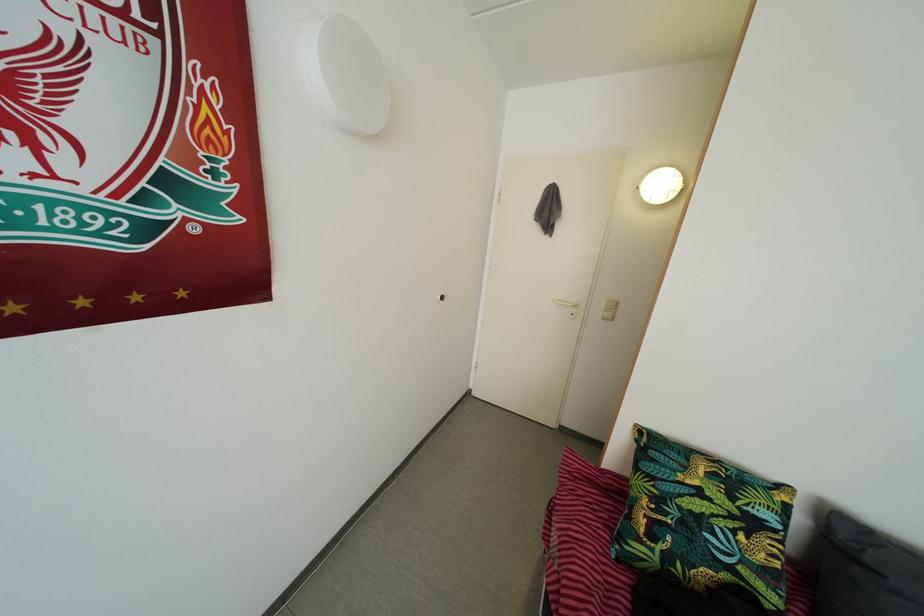
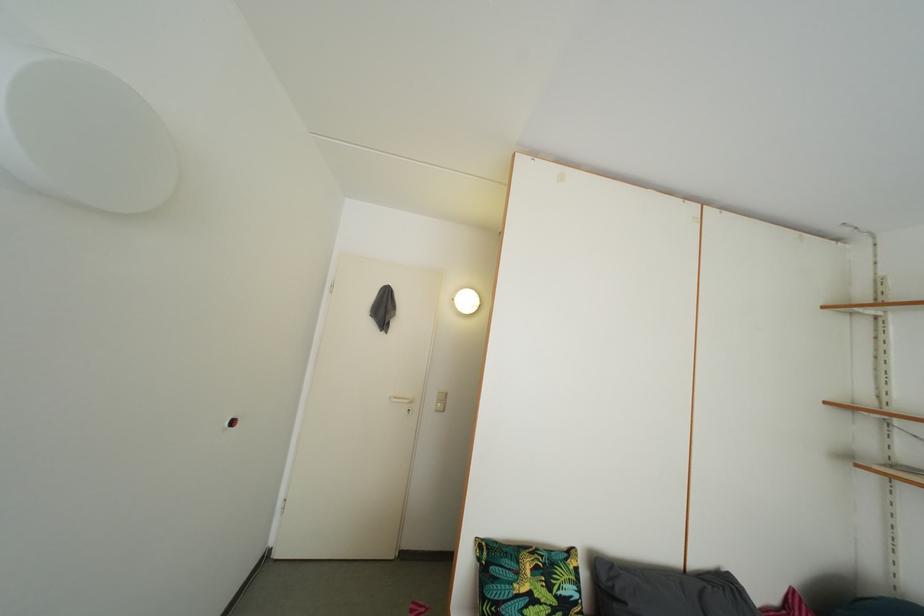
In the second image, find the point that corresponds to [873,568] in the first image.

(624, 601)